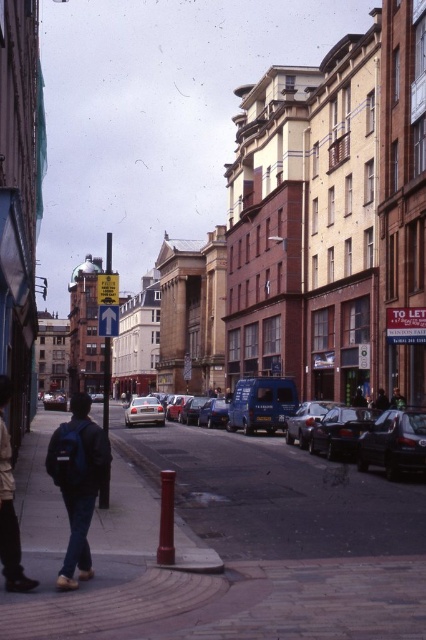
Can you confirm if silver metallic car at center is smaller than green fabric jacket at center?

Indeed, silver metallic car at center has a smaller size compared to green fabric jacket at center.

Find the location of `silver metallic car at center`. silver metallic car at center is located at coordinates (144, 412).

Does point (74, 563) come closer to viewer compared to point (356, 394)?

Yes.

Where is `dark blue backpack at lower left`? dark blue backpack at lower left is located at coordinates (77, 483).

Who is positioned more to the right, silver metallic car at center or shiny blue van at center?

shiny blue van at center

Is silver metallic car at center to the right of shiny blue van at center from the viewer's perspective?

Incorrect, silver metallic car at center is not on the right side of shiny blue van at center.

Who is more distant from viewer, (158, 419) or (204, 403)?

The point (204, 403) is behind.

You are a GUI agent. You are given a task and a screenshot of the screen. Output one action in this format:
    pyautogui.click(x=<x>, y=<y>)
    Task: Click on the silver metallic car at center
    This screenshot has height=640, width=426.
    Given the screenshot: What is the action you would take?
    pyautogui.click(x=144, y=412)